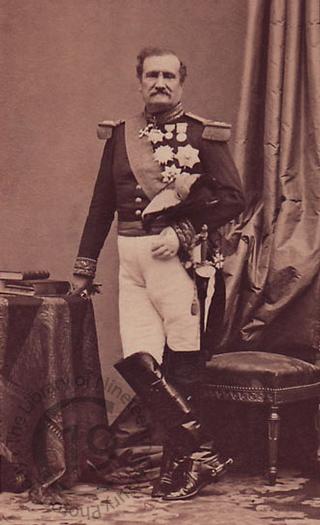
Identify the location of curtain. (298, 85).